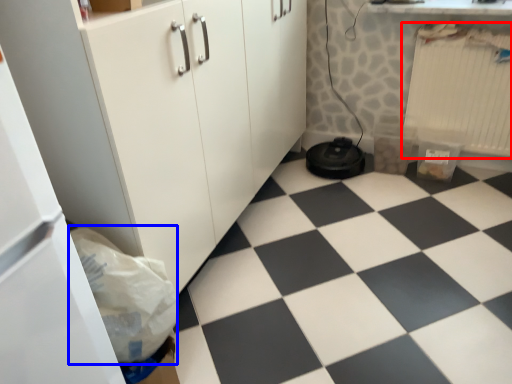
Question: Which of the following is the farthest to the observer, radiator (highlighted by a red box) or garbage (highlighted by a blue box)?

Choices:
 (A) radiator
 (B) garbage

Answer: (A)